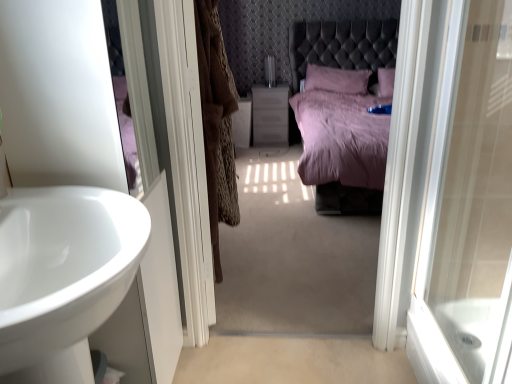
Question: Are matte plastic vanity at center and white glossy door at right beside each other?

Choices:
 (A) yes
 (B) no

Answer: (B)

Question: Does matte plastic vanity at center have a greater height compared to white glossy door at right?

Choices:
 (A) yes
 (B) no

Answer: (B)

Question: Does matte plastic vanity at center have a lesser width compared to white glossy door at right?

Choices:
 (A) no
 (B) yes

Answer: (A)

Question: From the image's perspective, is matte plastic vanity at center under white glossy door at right?

Choices:
 (A) no
 (B) yes

Answer: (A)

Question: Does matte plastic vanity at center appear on the right side of white glossy door at right?

Choices:
 (A) no
 (B) yes

Answer: (A)

Question: Is point (237, 216) positioned closer to the camera than point (456, 220)?

Choices:
 (A) closer
 (B) farther

Answer: (B)

Question: From a real-world perspective, is brown fur coat at center above or below white glossy door at right?

Choices:
 (A) above
 (B) below

Answer: (A)

Question: In the image, is brown fur coat at center positioned in front of or behind white glossy door at right?

Choices:
 (A) front
 (B) behind

Answer: (B)

Question: From the image's perspective, is brown fur coat at center located above or below white glossy door at right?

Choices:
 (A) above
 (B) below

Answer: (A)

Question: Based on their sizes in the image, would you say white glossy screen door at center is bigger or smaller than brown fur coat at center?

Choices:
 (A) small
 (B) big

Answer: (A)

Question: Would you say white glossy screen door at center is to the left or to the right of brown fur coat at center in the picture?

Choices:
 (A) right
 (B) left

Answer: (B)

Question: Is white glossy screen door at center situated inside brown fur coat at center or outside?

Choices:
 (A) outside
 (B) inside

Answer: (A)

Question: From the image's perspective, relative to brown fur coat at center, is white glossy screen door at center above or below?

Choices:
 (A) below
 (B) above

Answer: (A)

Question: Considering the positions of white glossy door at right and brown fur coat at center in the image, is white glossy door at right wider or thinner than brown fur coat at center?

Choices:
 (A) thin
 (B) wide

Answer: (A)

Question: Considering the positions of white glossy door at right and brown fur coat at center in the image, is white glossy door at right taller or shorter than brown fur coat at center?

Choices:
 (A) tall
 (B) short

Answer: (A)